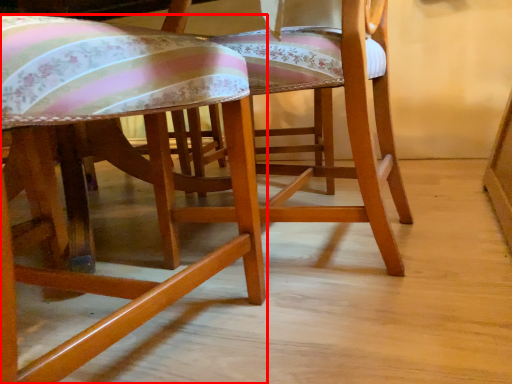
Question: From the image's perspective, where is chair (annotated by the red box) located relative to chair?

Choices:
 (A) below
 (B) above

Answer: (A)